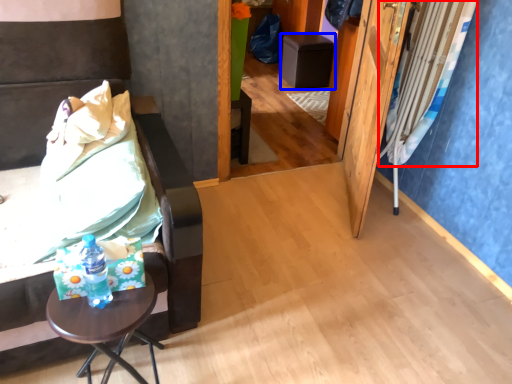
Question: Which object is further to the camera taking this photo, curtain (highlighted by a red box) or furniture (highlighted by a blue box)?

Choices:
 (A) curtain
 (B) furniture

Answer: (B)